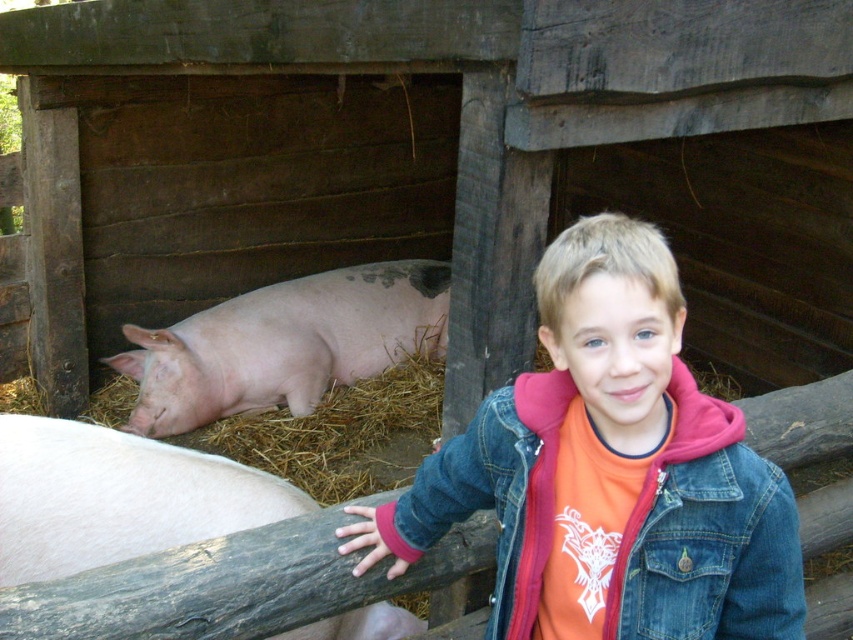
You are a photographer trying to capture the boy and the pigs in the image. The boy is standing at point (117, 497). Where should you position the camera to ensure both the boy and the pigs are in the frame?

The point (117, 497) corresponds to the pink smooth skin at left, so the photographer should position the camera to include both the boy at that point and the pigs in the enclosure, ensuring the entire scene is captured.

You are a photographer standing at the center of the scene. You want to take a photo of the pink smooth skin at left and the denim jacket at lower right. Can you fit both subjects into the frame without moving the camera? Explain your reasoning based on their distance.

The distance between the pink smooth skin at left and the denim jacket at lower right is 33.88 inches. Since the photographer is at the center, the subjects are positioned on opposite sides. Depending on the camera lens, if the lens has a wide enough angle to cover 33.88 inches at that distance, they can fit. However, standard lenses might require slight adjustment, but the question doesn

You are a photographer trying to capture a closeup of the pink smooth skin at left while ensuring the denim jacket at lower right is still visible in the frame. Given their sizes, will you need to adjust your camera angle to include both?

The denim jacket at lower right is wider than the pink smooth skin at left, so you may need to adjust your camera angle to ensure both are visible in the frame.